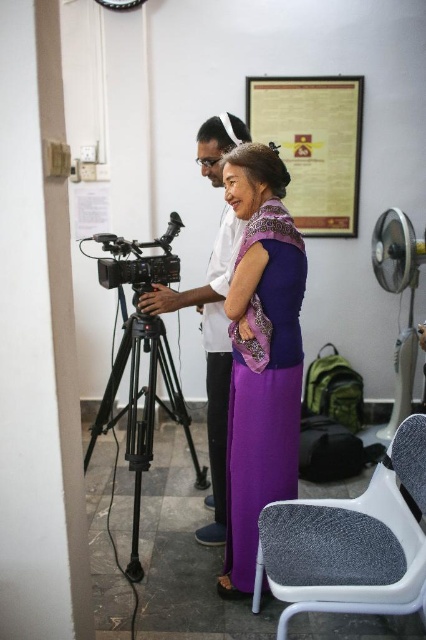
You are standing in the room and want to move from the gray fabric chair at lower right to the black plastic camera at center. Which direction should you move to get closer to the camera?

The gray fabric chair at lower right is closer to the viewer than the black plastic camera at center, so you should move backward to get closer to the camera.

You are a photographer who needs to ensure that the gold metallic plaque at upper center and the black plastic camera at center are both visible in your frame. Based on their sizes and positions, which object might require you to adjust your camera angle to include it properly?

The gold metallic plaque at upper center is taller than the black plastic camera at center, so it might require adjusting the camera angle to ensure its full height is captured in the frame.